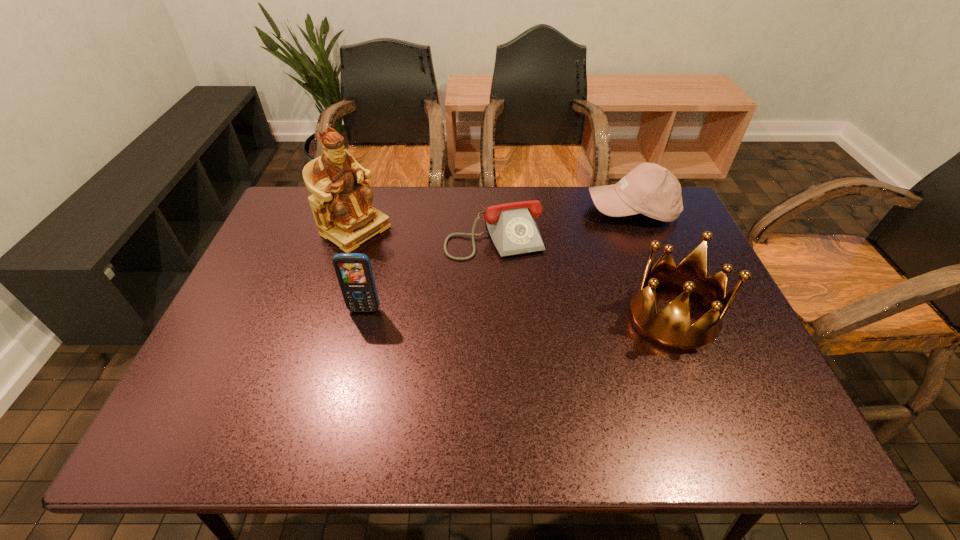
Image resolution: width=960 pixels, height=540 pixels. Identify the location of free location that satisfies the following two spatial constraints: 1. on the screen of the crown; 2. on the right side of the cellular telephone. (363, 317).